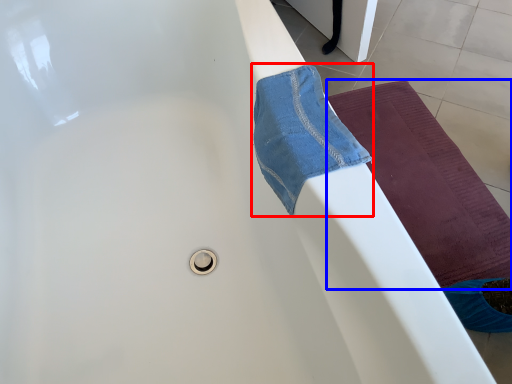
Question: Which point is closer to the camera, beach towel (highlighted by a red box) or yoga mat (highlighted by a blue box)?

Choices:
 (A) beach towel
 (B) yoga mat

Answer: (A)